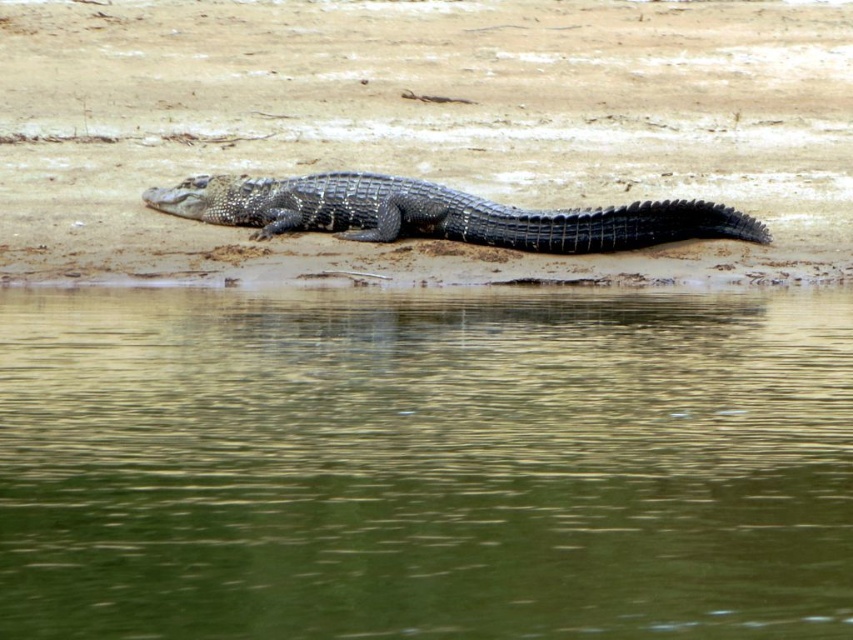
Which of these two, green smooth water at lower center or shiny black crocodile at center, stands taller?

green smooth water at lower center

Between green smooth water at lower center and shiny black crocodile at center, which one is positioned lower?

green smooth water at lower center

Is point (780, 465) behind point (312, 228)?

No, it is not.

At what (x,y) coordinates should I click in order to perform the action: click on green smooth water at lower center. Please return your answer as a coordinate pair (x, y). The height and width of the screenshot is (640, 853). Looking at the image, I should click on (424, 465).